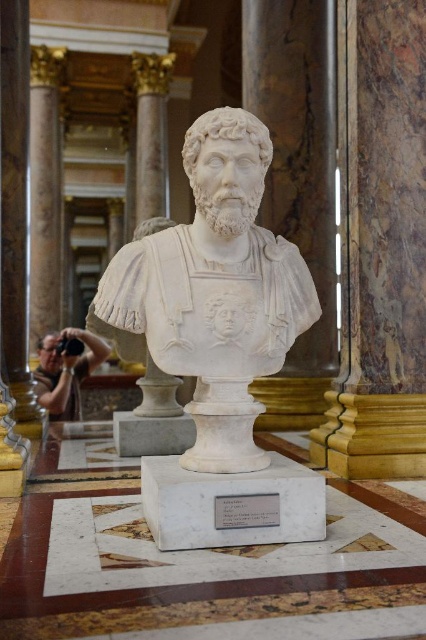
Question: Which object is positioned closest to the matte black camera at lower left?

Choices:
 (A) marble column at center
 (B) white marble bust at center

Answer: (A)

Question: Is white marble bust at center positioned behind matte black camera at lower left?

Choices:
 (A) no
 (B) yes

Answer: (A)

Question: Does marble column at center appear on the left side of matte black camera at lower left?

Choices:
 (A) yes
 (B) no

Answer: (B)

Question: Which of these objects is positioned closest to the marble column at center?

Choices:
 (A) matte black camera at lower left
 (B) white marble bust at center

Answer: (A)

Question: Observing the image, what is the correct spatial positioning of white marble bust at center in reference to marble column at center?

Choices:
 (A) left
 (B) right

Answer: (B)

Question: Among these objects, which one is nearest to the camera?

Choices:
 (A) marble column at center
 (B) white marble bust at center
 (C) matte black camera at lower left

Answer: (B)